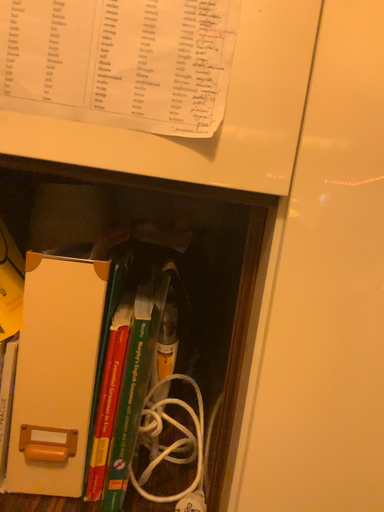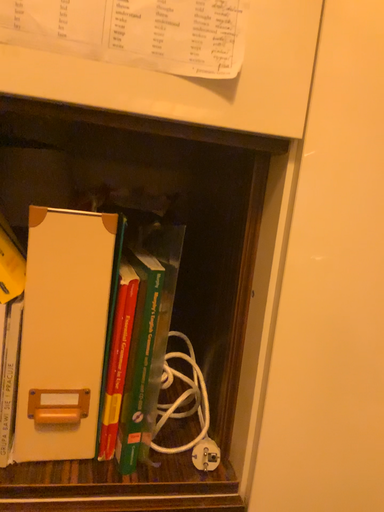
Question: Which way did the camera rotate in the video?

Choices:
 (A) rotated right
 (B) rotated left

Answer: (A)